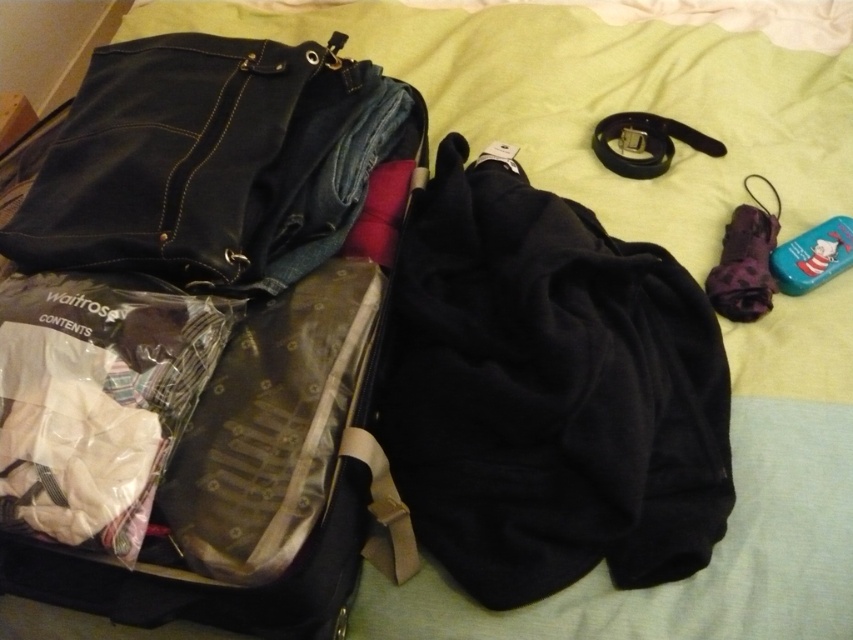
Who is taller, denim fabric suitcase at left or black fleece jacket at center?

Standing taller between the two is denim fabric suitcase at left.

Between point (16, 368) and point (491, 568), which one is positioned behind?

Positioned behind is point (491, 568).

At what (x,y) coordinates should I click in order to perform the action: click on denim fabric suitcase at left. Please return your answer as a coordinate pair (x, y). The image size is (853, 640). Looking at the image, I should click on (195, 336).